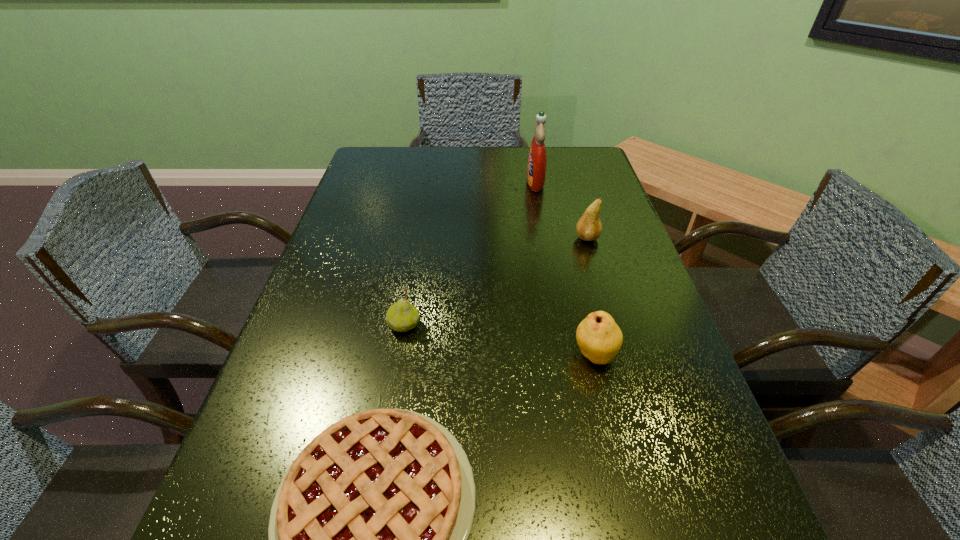
Identify the location of the farthest object. (537, 159).

Locate an element on the screen. the tallest object is located at coordinates tap(537, 159).

At what (x,y) coordinates should I click in order to perform the action: click on the farthest pear. Please return your answer as a coordinate pair (x, y). Looking at the image, I should click on [x=589, y=227].

This screenshot has width=960, height=540. Find the location of `the nearest pear`. the nearest pear is located at coordinates (600, 339).

Identify the location of the leftmost pear. (402, 316).

Where is `the third nearest object`? Image resolution: width=960 pixels, height=540 pixels. the third nearest object is located at coordinates (402, 316).

Locate an element on the screen. The height and width of the screenshot is (540, 960). free point located on the front surface of the tallest object is located at coordinates (438, 183).

I want to click on vacant space situated on the front surface of the tallest object, so 454,183.

This screenshot has width=960, height=540. In order to click on free space located 0.080m on the front surface of the tallest object in this screenshot , I will do `click(500, 183)`.

Where is `vacant space located 0.300m on the left of the farthest pear`? vacant space located 0.300m on the left of the farthest pear is located at coordinates (459, 238).